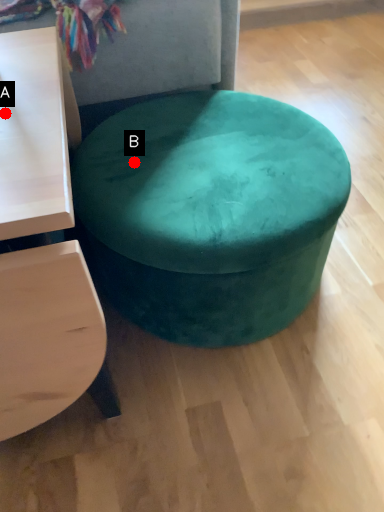
Question: Two points are circled on the image, labeled by A and B beside each circle. Which point is closer to the camera taking this photo?

Choices:
 (A) A is closer
 (B) B is closer

Answer: (A)